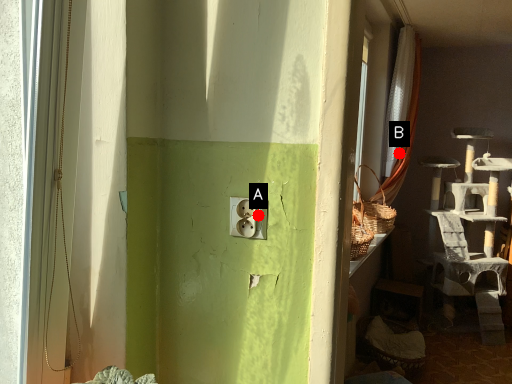
Question: Two points are circled on the image, labeled by A and B beside each circle. Which point is farther from the camera taking this photo?

Choices:
 (A) A is further
 (B) B is further

Answer: (B)